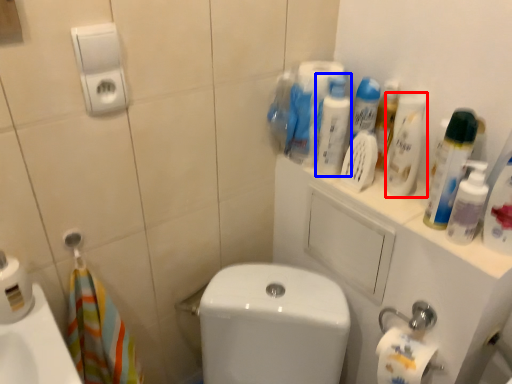
Question: Which object appears closest to the camera in this image, cleaning product (highlighted by a red box) or cleaning product (highlighted by a blue box)?

Choices:
 (A) cleaning product
 (B) cleaning product

Answer: (A)